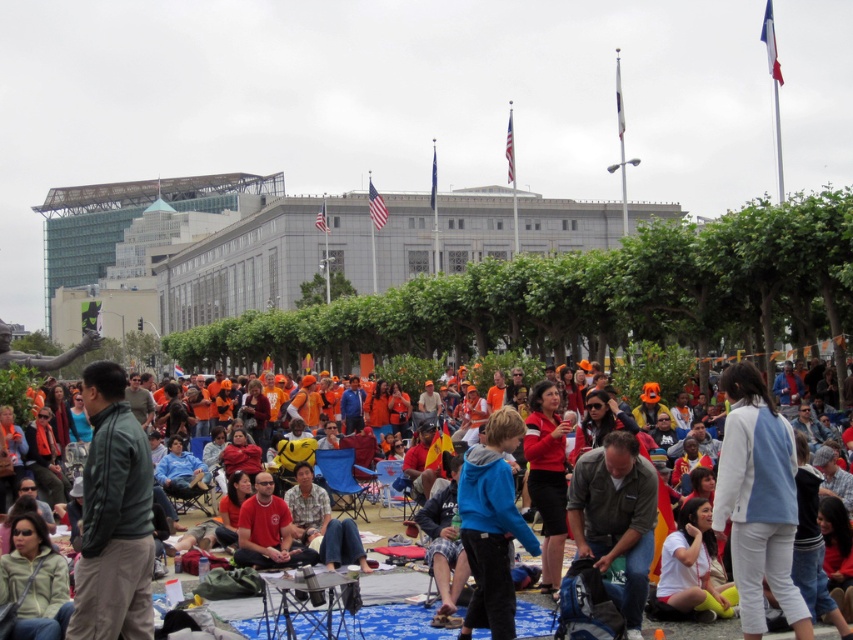
Question: Estimate the real-world distances between objects in this image. Which object is closer to the green matte jacket at lower left?

Choices:
 (A) matte black jacket at center
 (B) matte khaki shirt at center

Answer: (A)

Question: Observing the image, what is the correct spatial positioning of green matte jacket at lower left in reference to white cotton jacket at right?

Choices:
 (A) left
 (B) right

Answer: (A)

Question: Which is nearer to the matte black jacket at center?

Choices:
 (A) white cotton jacket at right
 (B) matte khaki shirt at center
 (C) blue fleece jacket at center

Answer: (B)

Question: Which of the following is the farthest from the observer?

Choices:
 (A) matte black jacket at center
 (B) matte khaki shirt at center
 (C) green matte jacket at lower left
 (D) white cotton jacket at right

Answer: (B)

Question: From the image, what is the correct spatial relationship of matte khaki shirt at center in relation to blue fleece jacket at center?

Choices:
 (A) left
 (B) right

Answer: (B)

Question: Can you confirm if blue fleece jacket at center is positioned below matte black jacket at center?

Choices:
 (A) no
 (B) yes

Answer: (B)